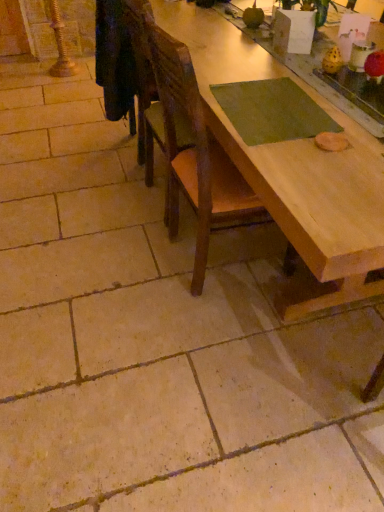
In order to click on vacant space in front of wooden chair at center in this screenshot , I will do `click(225, 336)`.